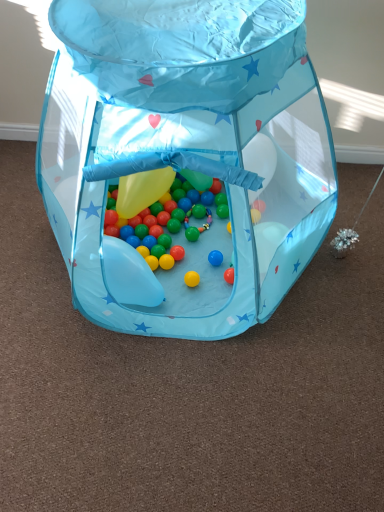
This screenshot has height=512, width=384. Identify the location of vacant space situated above shiny plastic beads at center (from a real-world perspective). (173, 225).